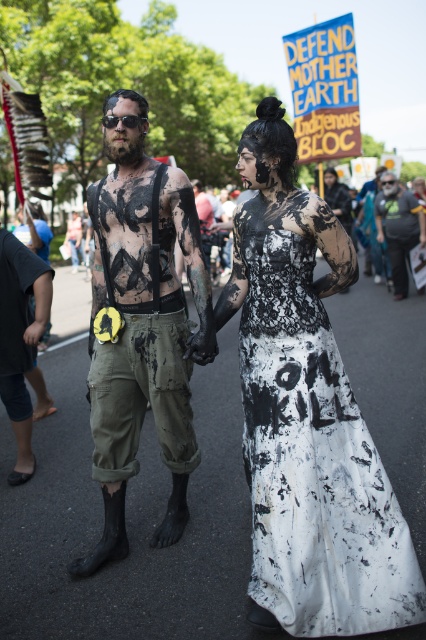
Question: Which of the following is the farthest from the observer?

Choices:
 (A) (322, 470)
 (B) (396, 205)
 (C) (114, 124)
 (D) (348, 216)

Answer: (D)

Question: Among these points, which one is farthest from the camera?

Choices:
 (A) (333, 186)
 (B) (353, 451)
 (C) (409, 224)

Answer: (A)

Question: Is white fabric shirt at right wider than black matte dress at center?

Choices:
 (A) yes
 (B) no

Answer: (B)

Question: Where is white lace dress at center located in relation to black matte dress at center in the image?

Choices:
 (A) below
 (B) above

Answer: (A)

Question: Estimate the real-world distances between objects in this image. Which object is farther from the black matte dress at center?

Choices:
 (A) white lace dress at center
 (B) white fabric shirt at right
 (C) matte black body paint at center

Answer: (A)

Question: Where is white lace dress at center located in relation to white fabric shirt at right in the image?

Choices:
 (A) above
 (B) below

Answer: (B)